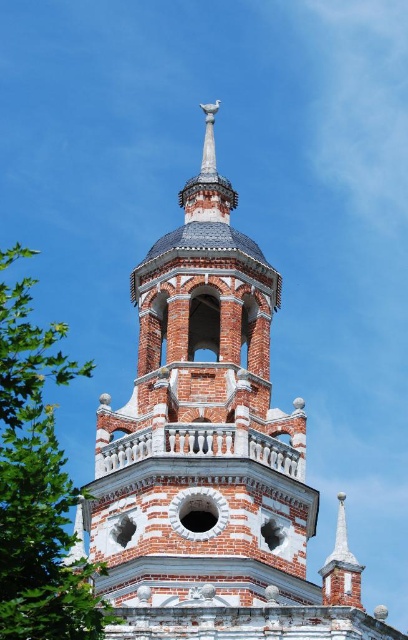
You are standing in front of the historic structure. There is a red brick tower at center and a green leafy tree at left. Which object is closer to you?

The red brick tower at center is positioned under green leafy tree at left, meaning the tower is closer to you than the tree.

You are standing in front of the red brick tower at center and the green leafy tree at left. Which object is closer to you?

The red brick tower at center is closer to you because it is positioned further to the viewer than the green leafy tree at left.

You are standing at the base of the historic tower. A maintenance worker needs to reach a specific point marked at coordinates point (152,547). They have a ladder that is 60 meters long. Can they safely reach the point with the ladder?

The point (152,547) is 62.39 meters away from the viewer. Since the ladder is only 60 meters long, it is not long enough to safely reach the point. The worker would need a longer ladder or additional equipment.